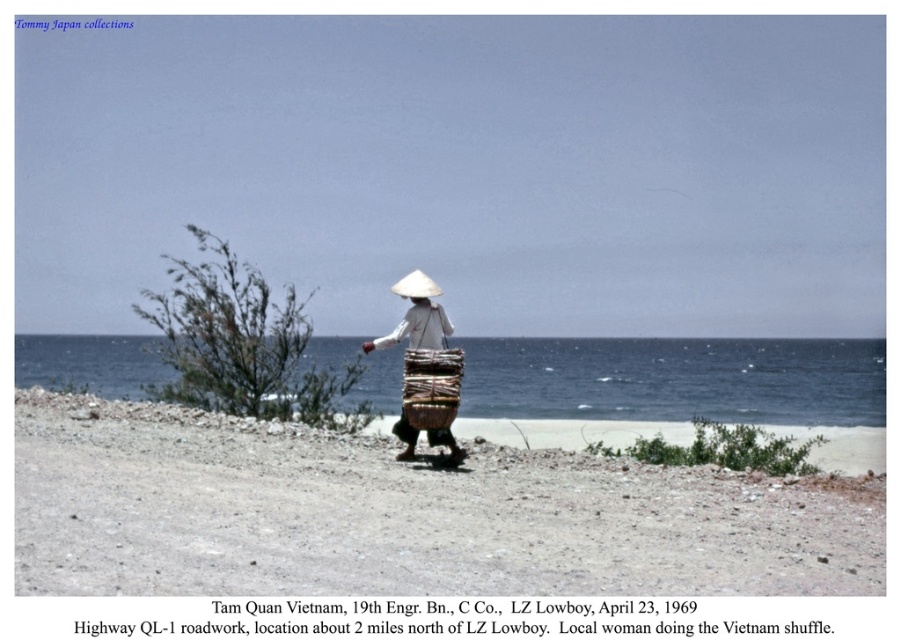
Does white woven basket at center appear over brown woven basket at center?

Indeed, white woven basket at center is positioned over brown woven basket at center.

Based on the photo, is white woven basket at center thinner than brown woven basket at center?

No, white woven basket at center is not thinner than brown woven basket at center.

Is point (425, 294) positioned in front of point (407, 356)?

That is False.

At what (x,y) coordinates should I click in order to perform the action: click on white woven basket at center. Please return your answer as a coordinate pair (x, y). The height and width of the screenshot is (640, 901). Looking at the image, I should click on (416, 316).

Looking at this image, does brown gravelly sand at center appear under brown woven basket at center?

A: Yes, brown gravelly sand at center is below brown woven basket at center.

Between brown gravelly sand at center and brown woven basket at center, which one is positioned higher?

brown woven basket at center is higher up.

Find the location of a particular element. Image resolution: width=901 pixels, height=640 pixels. brown gravelly sand at center is located at coordinates (403, 516).

I want to click on brown gravelly sand at center, so click(x=403, y=516).

Can you confirm if blue water at center is smaller than brown woven basket at center?

Incorrect, blue water at center is not smaller in size than brown woven basket at center.

Is blue water at center to the right of brown woven basket at center from the viewer's perspective?

No, blue water at center is not to the right of brown woven basket at center.

Describe the element at coordinates (677, 380) in the screenshot. I see `blue water at center` at that location.

Find the location of a particular element. Image resolution: width=901 pixels, height=640 pixels. blue water at center is located at coordinates (677, 380).